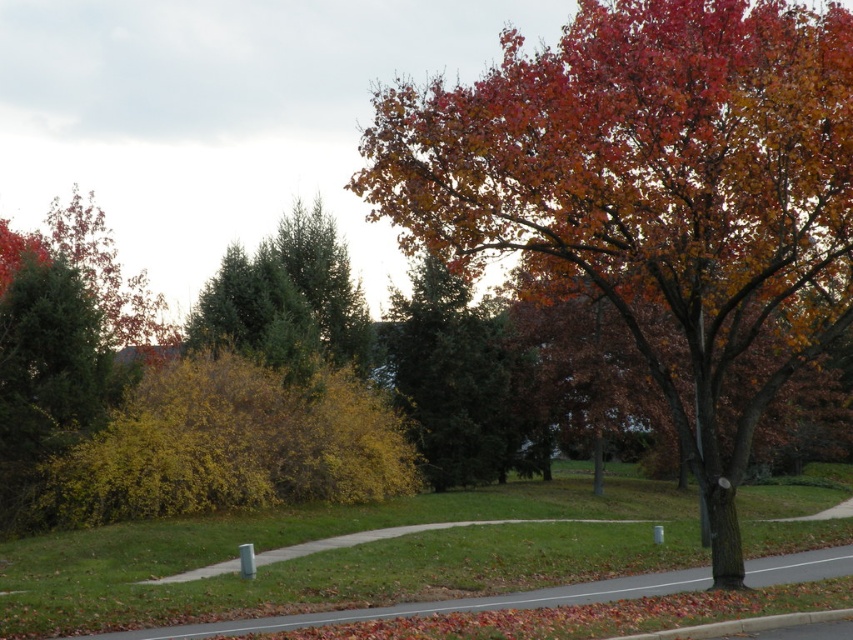
You are standing at the center of the image and want to walk towards the autumn leaves tree at center. In which direction should you head?

The autumn leaves tree at center is located at point (x=654, y=196), so you should head towards the lower right direction since the coordinates indicate it is positioned slightly to the right and below the center point.